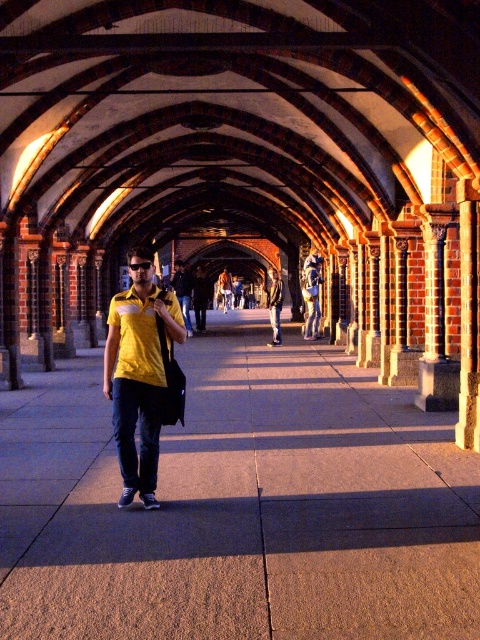
You are an artist sketching the scene from the walkway entrance. You notice the matte yellow shirt at center and denim pants at center. Which clothing item appears shorter in your drawing?

The matte yellow shirt at center appears shorter than the denim pants at center in the drawing.

You are a delivery person trying to place a package on the ground. You see the concrete pavement at center and the denim pants at center. Which one is the correct surface to place the package?

The concrete pavement at center is the correct surface to place the package because it is positioned under the denim pants at center, meaning the denim pants are above the pavement.

You are standing at the entrance of the walkway and want to place a small potted plant between the concrete pavement at center and the matte yellow shirt at center. Based on their positions, which object should the plant be closer to?

The concrete pavement at center is located below the matte yellow shirt at center, so the plant should be placed closer to the concrete pavement at center to maintain the vertical alignment between them.